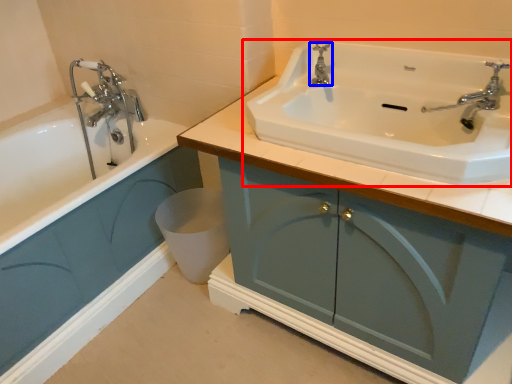
Question: Which object is closer to the camera taking this photo, sink (highlighted by a red box) or tap (highlighted by a blue box)?

Choices:
 (A) sink
 (B) tap

Answer: (A)